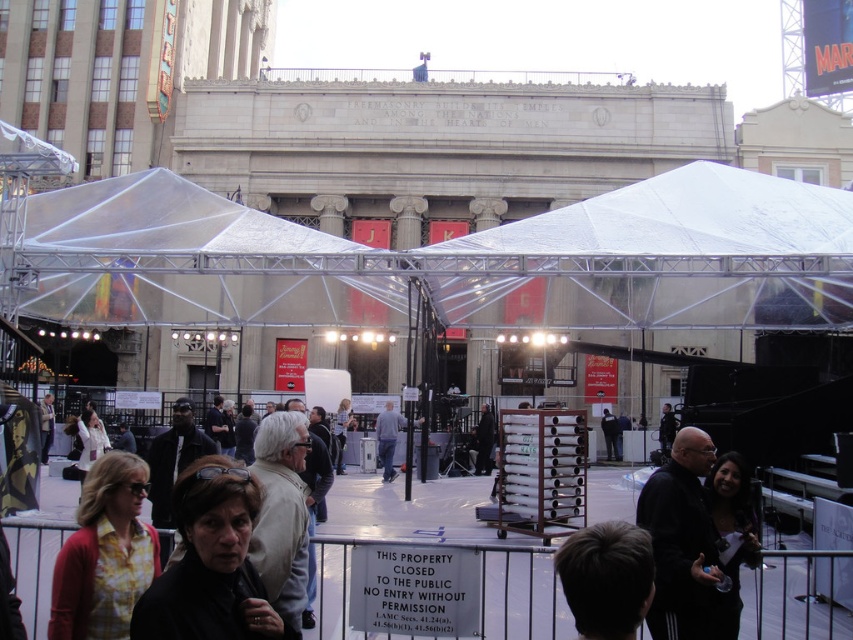
Question: Can you confirm if matte black jacket at center is positioned to the left of dark brown hair at center?

Choices:
 (A) yes
 (B) no

Answer: (A)

Question: Estimate the real-world distances between objects in this image. Which object is farther from the matte black jacket at center?

Choices:
 (A) black fabric at center
 (B) dark brown hair at center
 (C) dark gray suit at center

Answer: (C)

Question: Based on their relative distances, which object is farther from the dark brown hair at center?

Choices:
 (A) light gray fabric jacket at center
 (B) black leather jacket at center
 (C) black matte jacket at lower right

Answer: (A)

Question: Observing the image, what is the correct spatial positioning of black matte jacket at lower right in reference to black fabric at center?

Choices:
 (A) left
 (B) right

Answer: (B)

Question: Can you confirm if dark brown hair at center is smaller than black leather jacket at center?

Choices:
 (A) no
 (B) yes

Answer: (A)

Question: Estimate the real-world distances between objects in this image. Which object is closer to the black leather jacket at center?

Choices:
 (A) light gray fabric jacket at center
 (B) yellow tie-dye shirt at lower left

Answer: (A)